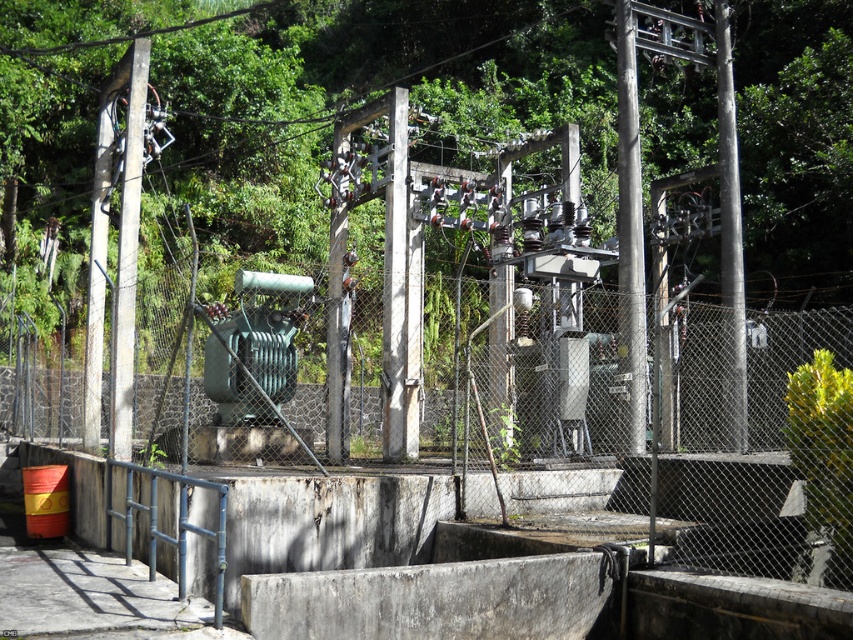
You are standing at the entrance of the substation and want to reach a specific point marked at coordinates point (641, 216). Given that the maximum distance your equipment can safely operate is 50 feet, will you be able to reach that point without moving closer?

The distance of point (641, 216) from camera is 46.07 feet, which is within the 50 feet safety limit. Therefore, you can reach the point without moving closer.

You are standing at the entrance of the substation and see the point marked at coordinates (x=630, y=236). What object is located at that point?

The point marked at coordinates (x=630, y=236) marks a rusty metal pole at center.

You are standing at the entrance of the substation and see the point marked at coordinate (730, 237). What object is located at this coordinate?

The point at coordinate (730, 237) corresponds to the smooth gray pole at right.